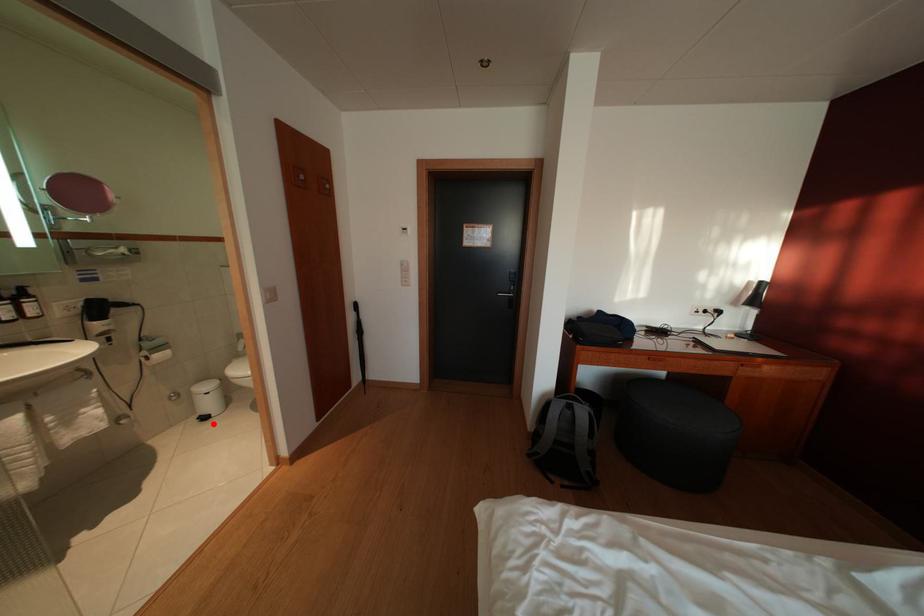
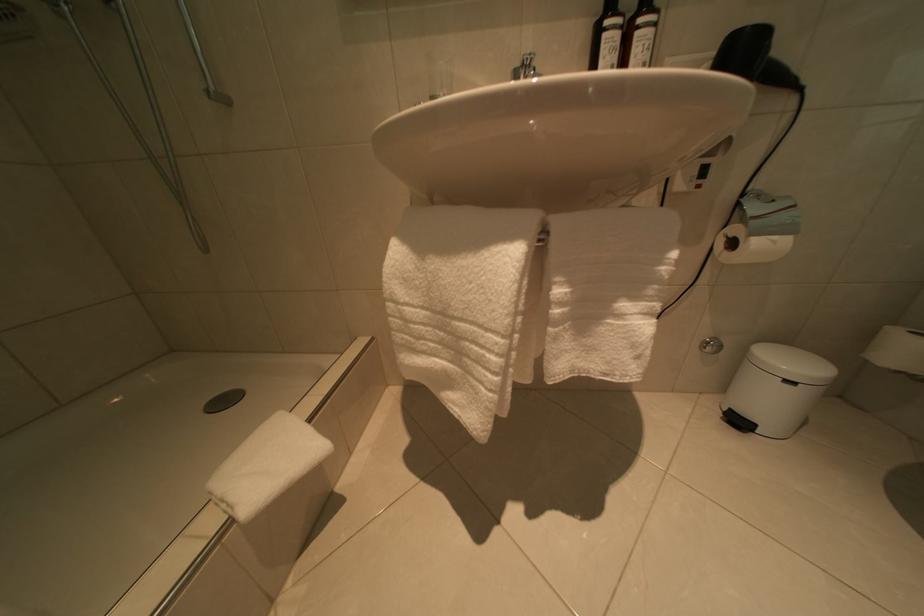
Question: I am providing you with two images of the same scene from different viewpoints. A red point is shown in image1. For the corresponding object point in image2, is it positioned nearer or farther from the camera?

Choices:
 (A) Nearer
 (B) Farther

Answer: (A)